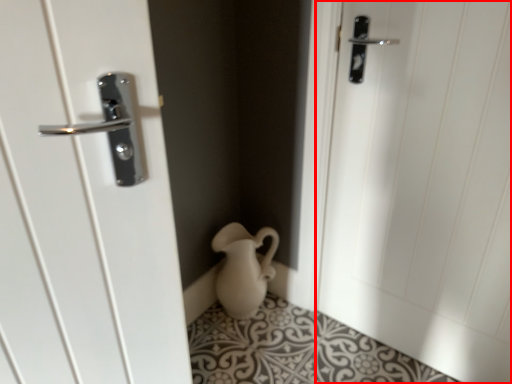
Question: From the image's perspective, what is the correct spatial positioning of door (annotated by the red box) in reference to jug?

Choices:
 (A) above
 (B) below

Answer: (A)